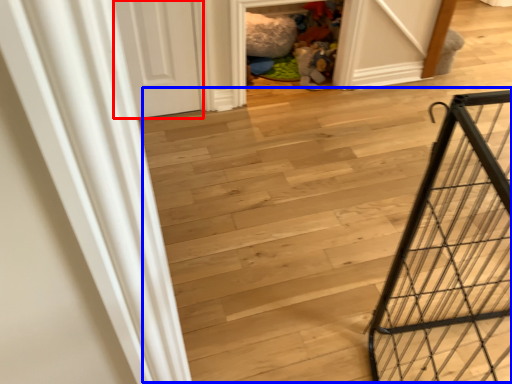
Question: Which object is further to the camera taking this photo, door (highlighted by a red box) or stairwell (highlighted by a blue box)?

Choices:
 (A) door
 (B) stairwell

Answer: (A)